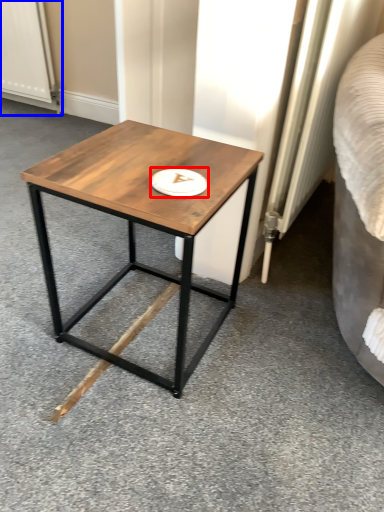
Question: Which point is further to the camera, platter (highlighted by a red box) or screen door (highlighted by a blue box)?

Choices:
 (A) platter
 (B) screen door

Answer: (B)